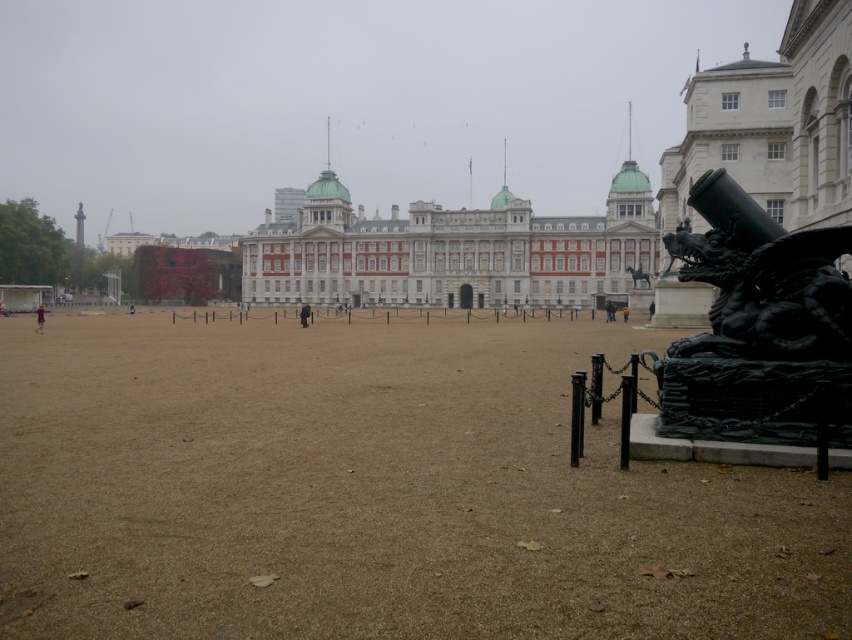
Question: Can you confirm if black polished statue at center-right is positioned below dark brown leather jacket at lower left?

Choices:
 (A) no
 (B) yes

Answer: (A)

Question: Can you confirm if dark brown leather jacket at center is smaller than orange uniformed person at center?

Choices:
 (A) yes
 (B) no

Answer: (B)

Question: Is dark brown leather jacket at lower left to the right of dark brown leather jacket at center from the viewer's perspective?

Choices:
 (A) yes
 (B) no

Answer: (B)

Question: Which of the following is the farthest from the observer?

Choices:
 (A) dark brown leather jacket at lower left
 (B) black matte person at center

Answer: (B)

Question: Considering the real-world distances, which object is closest to the brown gravel at center?

Choices:
 (A) black polished statue at center-right
 (B) black polished stone dragon at lower right

Answer: (B)

Question: Estimate the real-world distances between objects in this image. Which object is closer to the brown gravel at center?

Choices:
 (A) dark brown leather jacket at center
 (B) black matte person at center

Answer: (B)